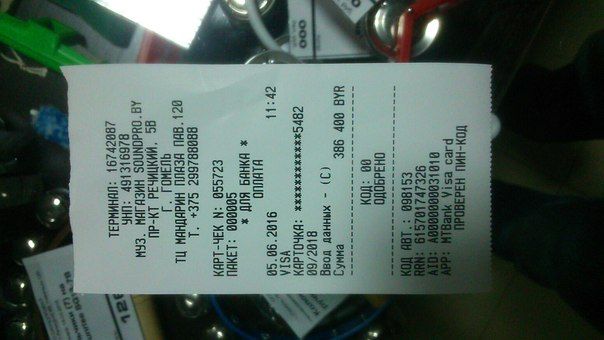
This screenshot has width=604, height=340. I want to click on green toy, so 47,46, 23,36, 63,52.